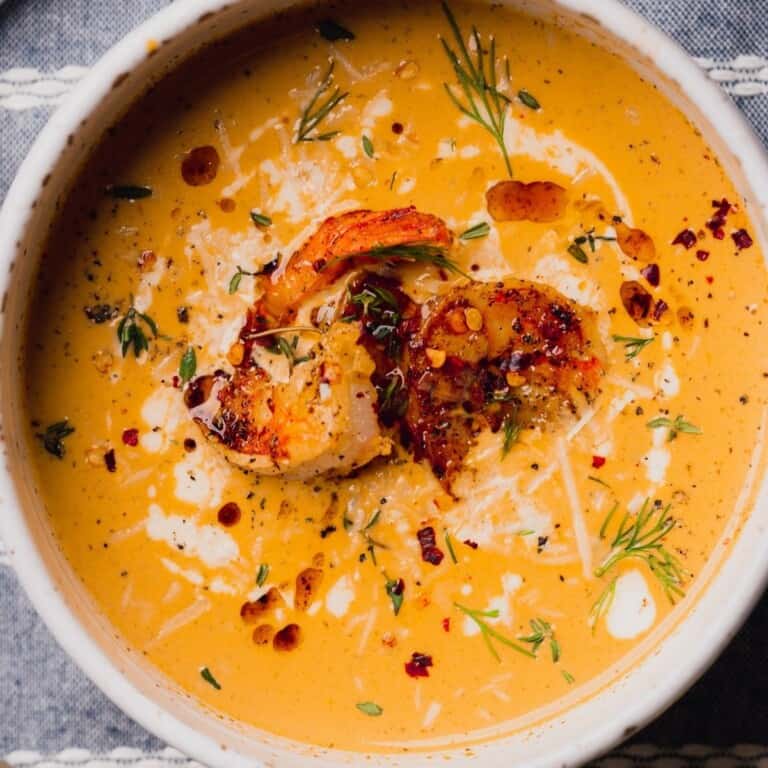
I want to click on gray cloth, so click(37, 666).